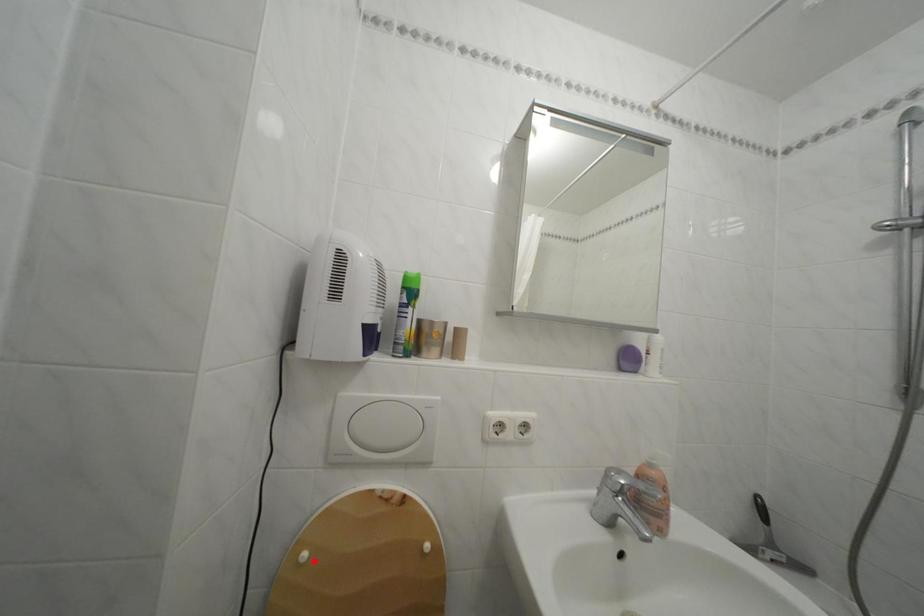
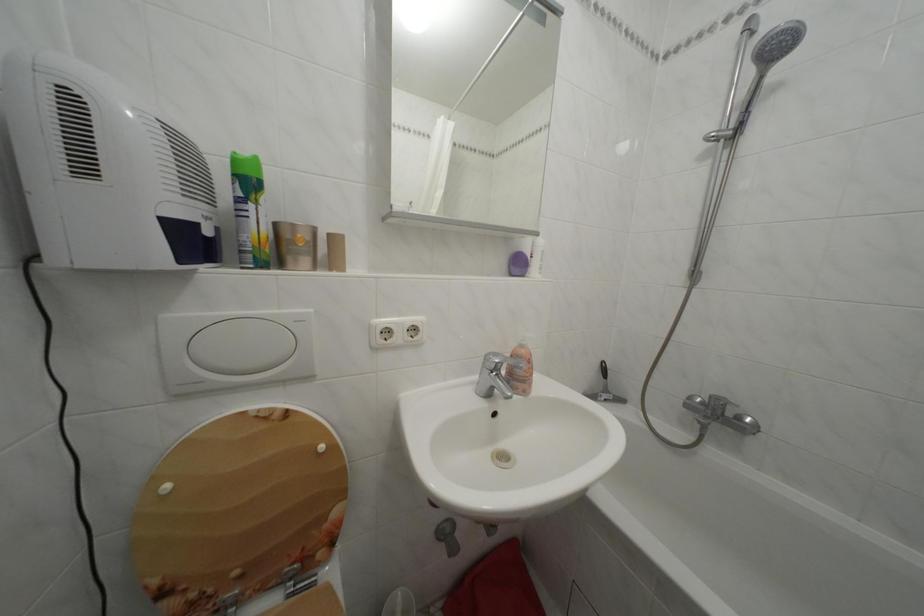
Where in the second image is the point corresponding to the highlighted location from the first image?

(176, 493)